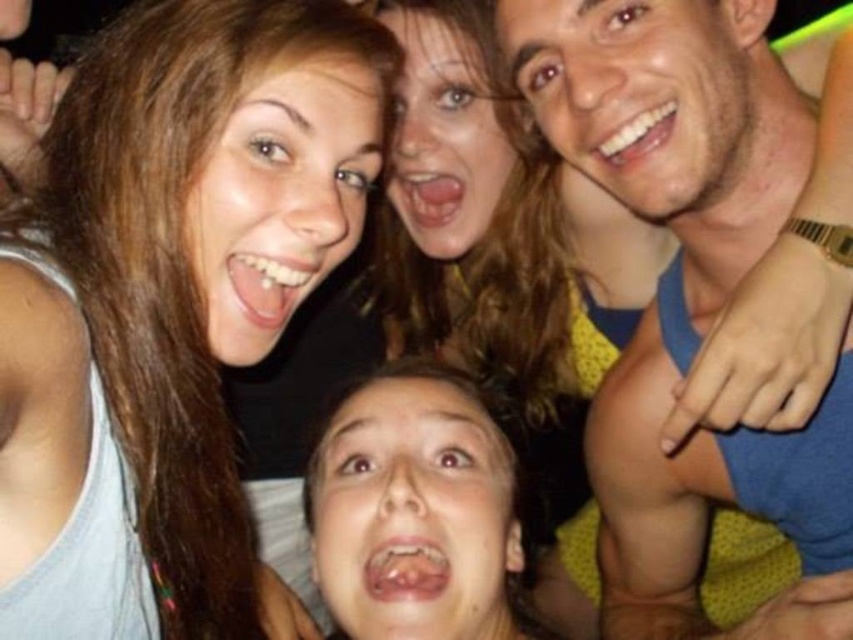
Question: Which object is the closest to the matte gray tank top at lower left?

Choices:
 (A) matte black top at upper center
 (B) smooth skin man at upper right

Answer: (B)

Question: Is matte gray tank top at lower left bigger than smooth skin man at upper right?

Choices:
 (A) yes
 (B) no

Answer: (A)

Question: Which point is closer to the camera?

Choices:
 (A) smooth skin man at upper right
 (B) matte black top at upper center
 (C) matte gray tank top at lower left

Answer: (C)

Question: Can you confirm if smooth skin man at upper right is thinner than matte black top at upper center?

Choices:
 (A) no
 (B) yes

Answer: (B)

Question: Which object appears closest to the camera in this image?

Choices:
 (A) matte gray tank top at lower left
 (B) matte black top at upper center
 (C) smooth skin man at upper right

Answer: (A)

Question: Can you confirm if matte gray tank top at lower left is positioned below matte black top at upper center?

Choices:
 (A) yes
 (B) no

Answer: (B)